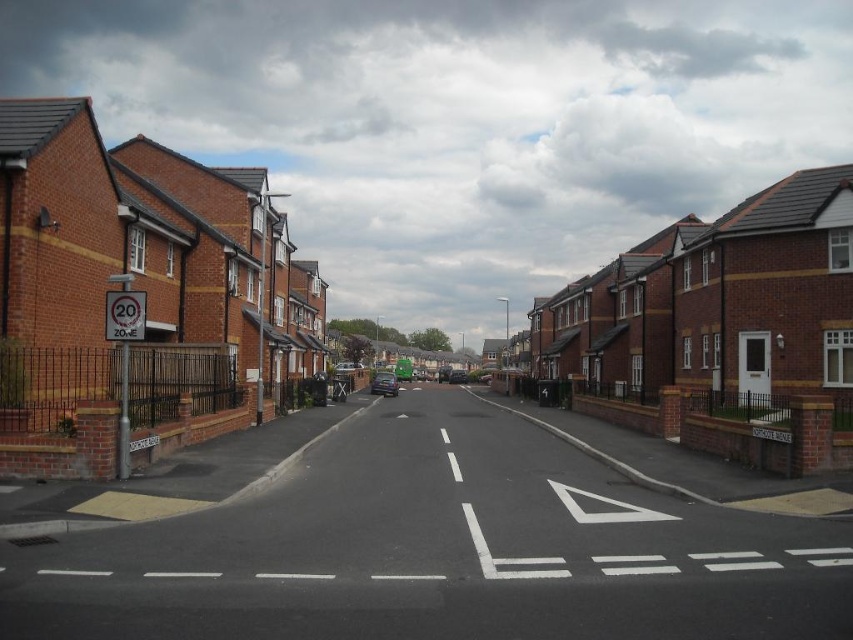
You are driving a car and see both the metallic blue car at center and the shiny black car at center ahead on the same street. Which car is closer to you?

The metallic blue car at center is closer to you since it is in front of the shiny black car at center.

You are a delivery driver trying to park your van between the metallic blue car at center and the shiny black car at center on this residential street. The van is 2.5 meters wide. Can you fit your van between them?

The metallic blue car at center is wider than the shiny black car at center. Therefore, the space between them may not be sufficient for a 2.5 meter wide van. Check the exact distance before attempting to park.

You are a pedestrian standing at the edge of the sidewalk near the 20 Zone sign. You want to cross the street to reach the house on the opposite side. The metallic blue car at center and shiny black car at center are parked in the street. Can you safely cross between them without stepping into the road? Explain your reasoning.

The metallic blue car at center and shiny black car at center are 24.64 meters apart from each other. Since the distance between them is over 24 meters, there is enough space for a pedestrian to safely cross between them without needing to step into the road. However, always ensure no vehicles are moving before crossing.